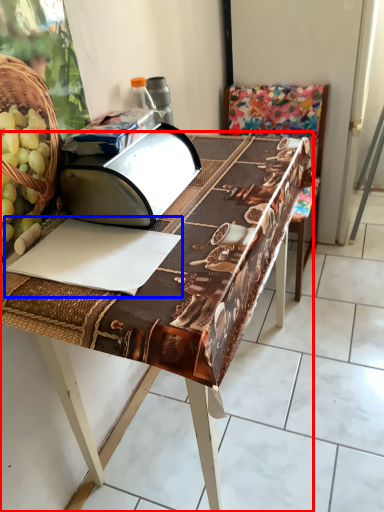
Question: Which point is further to the camera, table (highlighted by a red box) or wrapping paper (highlighted by a blue box)?

Choices:
 (A) table
 (B) wrapping paper

Answer: (B)